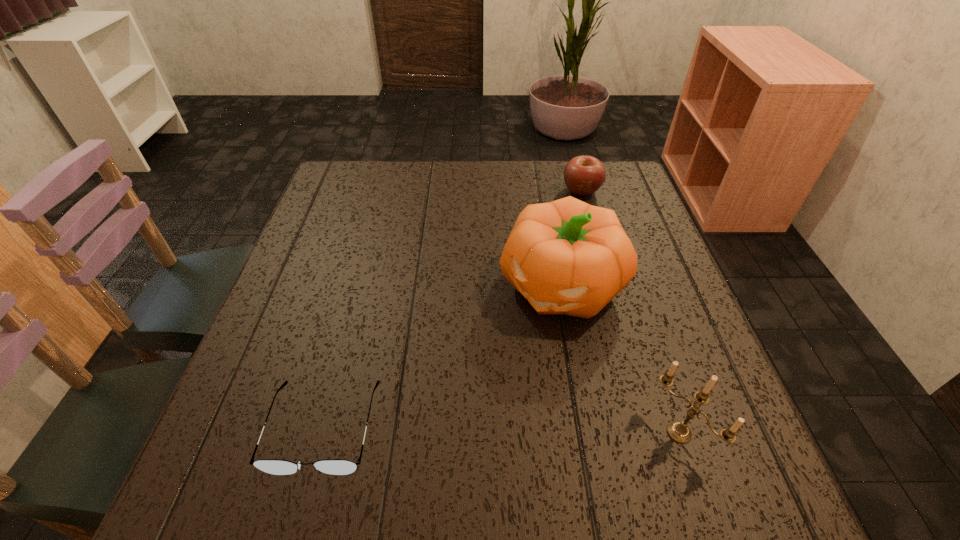
Locate an element on the screen. The width and height of the screenshot is (960, 540). free spot that satisfies the following two spatial constraints: 1. on the back side of the third tallest object; 2. on the right side of the second farthest object is located at coordinates (543, 191).

Locate an element on the screen. Image resolution: width=960 pixels, height=540 pixels. blank space that satisfies the following two spatial constraints: 1. on the lenses of the second tallest object; 2. on the right side of the leftmost object is located at coordinates (323, 433).